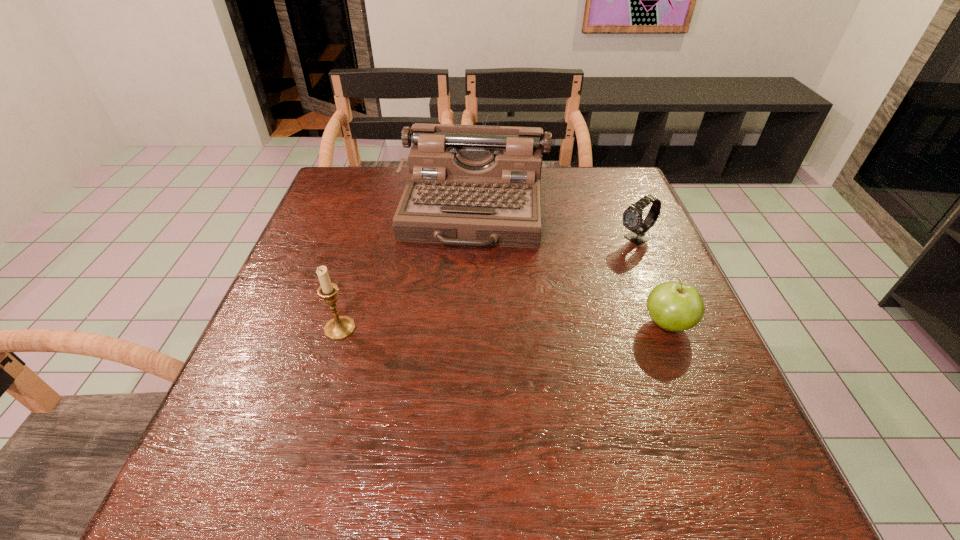
Find the location of a particular element. The image size is (960, 540). the leftmost object is located at coordinates (340, 327).

Identify the location of candle holder. click(340, 327).

I want to click on apple, so click(x=674, y=306).

At what (x,y) coordinates should I click in order to perform the action: click on the tallest object. Please return your answer as a coordinate pair (x, y). Looking at the image, I should click on (473, 185).

At what (x,y) coordinates should I click in order to perform the action: click on typewriter. Please return your answer as a coordinate pair (x, y). Looking at the image, I should click on (473, 185).

The image size is (960, 540). I want to click on watch, so click(632, 217).

This screenshot has width=960, height=540. Find the location of `vacant space located on the front of the leftmost object`. vacant space located on the front of the leftmost object is located at coordinates (315, 413).

Find the location of a particular element. The height and width of the screenshot is (540, 960). free space located 0.350m on the left of the apple is located at coordinates (471, 324).

Where is `free space located on the keyboard of the tallest object`? This screenshot has width=960, height=540. free space located on the keyboard of the tallest object is located at coordinates (459, 307).

At what (x,y) coordinates should I click in order to perform the action: click on free space located on the keyboard of the tallest object. Please return your answer as a coordinate pair (x, y). Looking at the image, I should click on (460, 300).